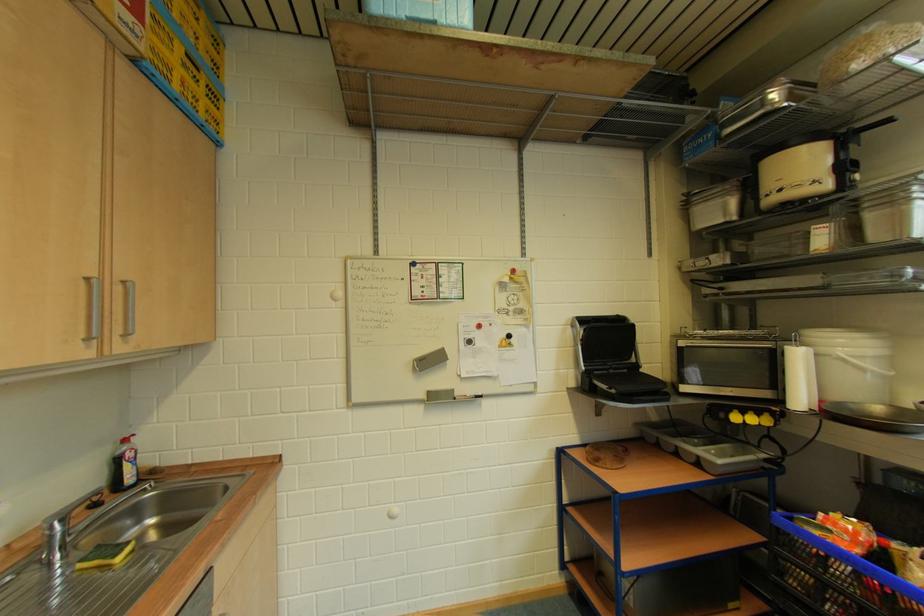
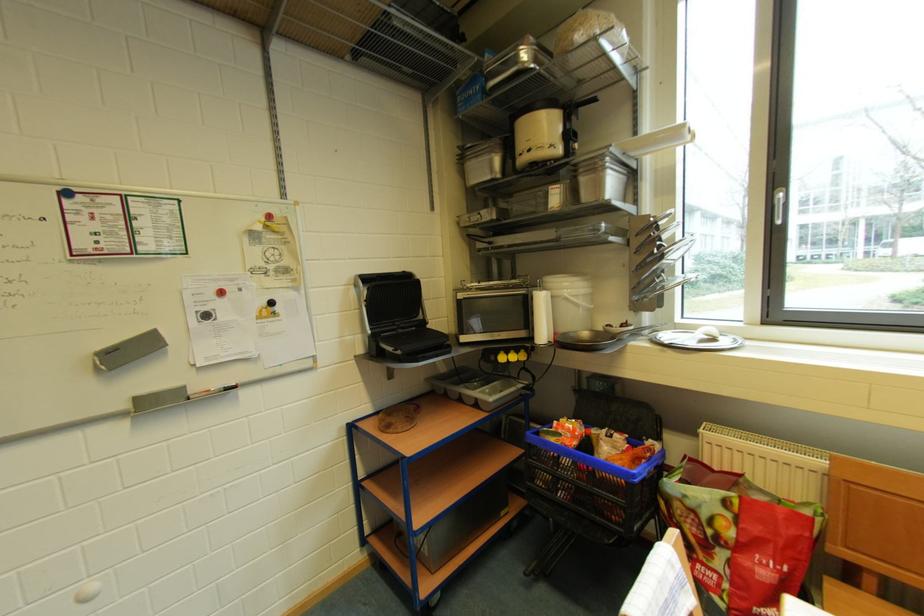
The point at (805, 359) is marked in the first image. Where is the corresponding point in the second image?

(548, 302)